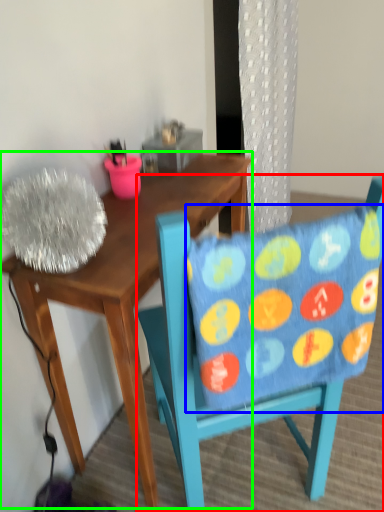
Question: Which object is positioned closest to chair (highlighted by a red box)? Select from pillow (highlighted by a blue box) and desk (highlighted by a green box).

Choices:
 (A) pillow
 (B) desk

Answer: (A)